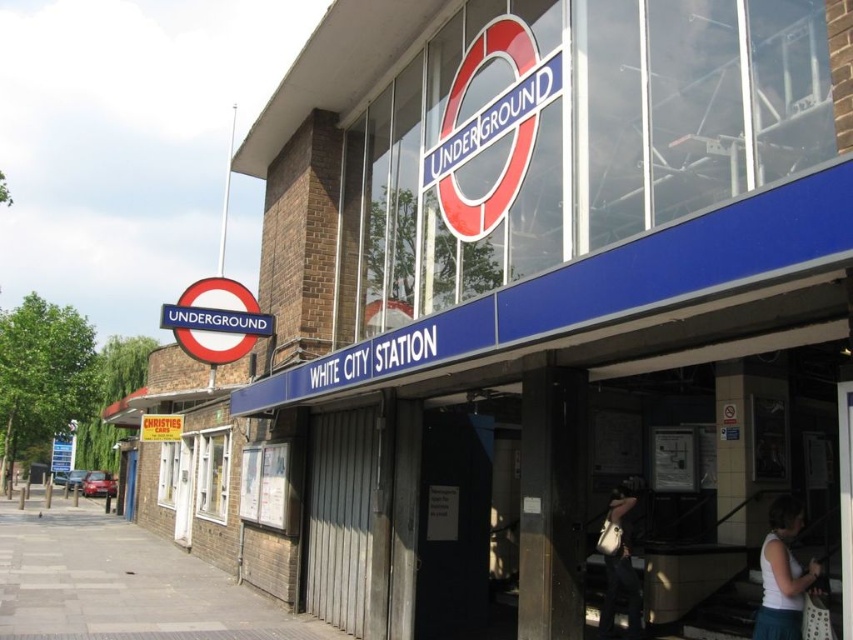
Question: Considering the real-world distances, which object is farthest from the gray concrete pavement at lower left?

Choices:
 (A) blue metallic signboard at center
 (B) leather handbag at lower right

Answer: (B)

Question: Can you confirm if gray concrete pavement at lower left is smaller than white fabric bag at lower right?

Choices:
 (A) no
 (B) yes

Answer: (A)

Question: Which point is closer to the camera?

Choices:
 (A) blue metallic signboard at center
 (B) white fabric bag at lower right
 (C) leather handbag at lower right
 (D) gray concrete pavement at lower left

Answer: (A)

Question: Can you confirm if white fabric bag at lower right is thinner than leather handbag at lower right?

Choices:
 (A) no
 (B) yes

Answer: (B)

Question: Does blue metallic signboard at center lie behind gray concrete pavement at lower left?

Choices:
 (A) yes
 (B) no

Answer: (B)

Question: Among these points, which one is nearest to the camera?

Choices:
 (A) (560, 602)
 (B) (793, 586)

Answer: (B)